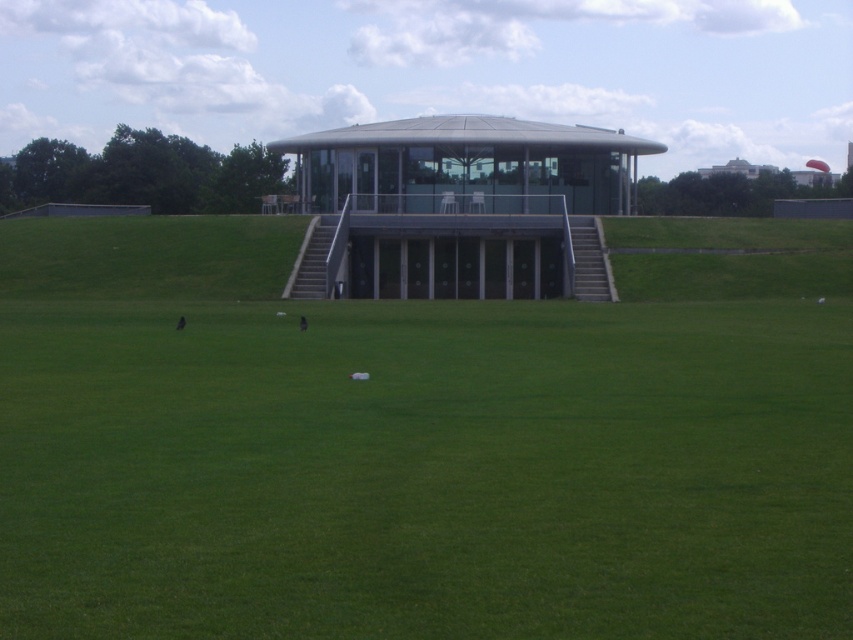
Who is shorter, green grass at center or metallic glass gazebo at center?

With less height is green grass at center.

Is point (260, 570) less distant than point (364, 180)?

Yes, it is.

Between point (621, 384) and point (463, 160), which one is positioned behind?

Point (463, 160)

You are a GUI agent. You are given a task and a screenshot of the screen. Output one action in this format:
    pyautogui.click(x=<x>, y=<y>)
    Task: Click on the green grass at center
    
    Given the screenshot: What is the action you would take?
    pyautogui.click(x=407, y=451)